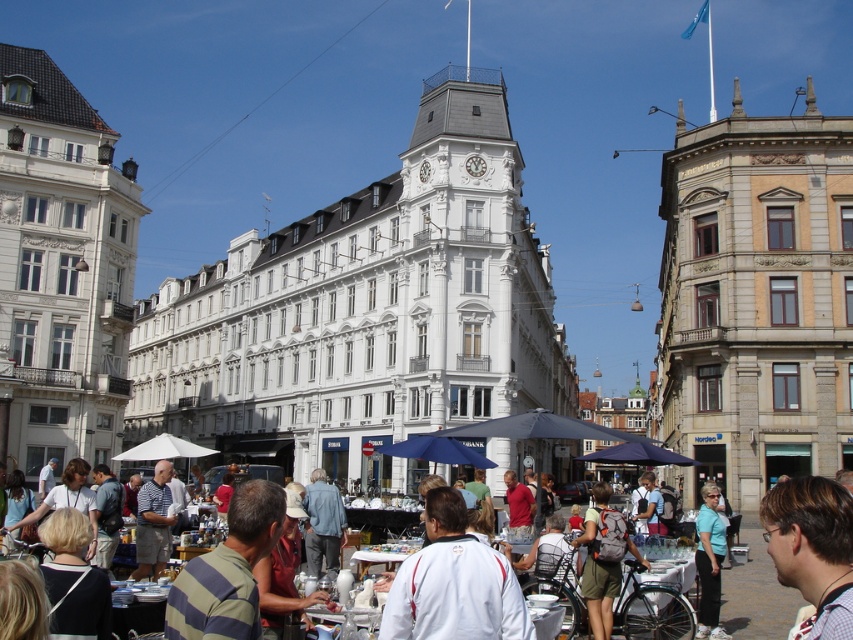
Is white cotton shirt at center below light blue t-shirt at center?

Actually, white cotton shirt at center is above light blue t-shirt at center.

Can you confirm if white cotton shirt at center is thinner than light blue t-shirt at center?

In fact, white cotton shirt at center might be wider than light blue t-shirt at center.

Where is `white cotton shirt at center`? The height and width of the screenshot is (640, 853). white cotton shirt at center is located at coordinates (453, 582).